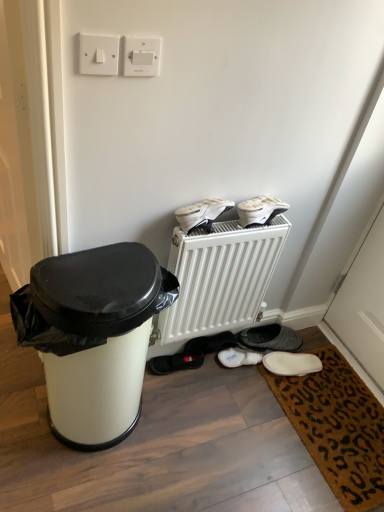
Image resolution: width=384 pixels, height=512 pixels. Identify the location of brown coir mat at lower right. (337, 426).

Measure the distance between point (x=223, y=364) and camera.

They are 5.64 feet apart.

This screenshot has width=384, height=512. What do you see at coordinates (201, 214) in the screenshot? I see `white matte sneakers at upper center, the first footwear from the front` at bounding box center [201, 214].

You are a GUI agent. You are given a task and a screenshot of the screen. Output one action in this format:
    pyautogui.click(x=<x>, y=<y>)
    Task: Click on the brown coir mat at lower right
    This screenshot has width=384, height=512.
    Given the screenshot: What is the action you would take?
    pos(337,426)

In terms of height, does white matte plastic trash can at left look taller or shorter compared to white plastic switch at upper center, marked as the first electric outlet in a right-to-left arrangement?

Considering their sizes, white matte plastic trash can at left has more height than white plastic switch at upper center, marked as the first electric outlet in a right-to-left arrangement.

From a real-world perspective, is white matte plastic trash can at left physically above white plastic switch at upper center, marked as the first electric outlet in a right-to-left arrangement?

Actually, white matte plastic trash can at left is physically below white plastic switch at upper center, marked as the first electric outlet in a right-to-left arrangement, in the real world.

Based on the photo, from the image's perspective, is white matte plastic trash can at left located beneath white plastic switch at upper center, marked as the first electric outlet in a right-to-left arrangement?

Correct, white matte plastic trash can at left appears lower than white plastic switch at upper center, marked as the first electric outlet in a right-to-left arrangement, in the image.

Is white matte plastic trash can at left oriented away from white plastic switch at upper center, marked as the first electric outlet in a right-to-left arrangement?

No, white matte plastic trash can at left is not facing away from white plastic switch at upper center, marked as the first electric outlet in a right-to-left arrangement.

Between white plastic switch at upper center, marked as the first electric outlet in a right-to-left arrangement, and white matte plastic trash can at left, which one has smaller width?

Thinner between the two is white plastic switch at upper center, marked as the first electric outlet in a right-to-left arrangement.

How distant is white plastic switch at upper center, marked as the first electric outlet in a right-to-left arrangement, from white matte plastic trash can at left?

28.33 inches.

Is white plastic switch at upper center, marked as the first electric outlet in a right-to-left arrangement, positioned beyond the bounds of white matte plastic trash can at left?

Yes, white plastic switch at upper center, marked as the first electric outlet in a right-to-left arrangement, is outside of white matte plastic trash can at left.

From the image's perspective, is white plastic switch at upper center, marked as the first electric outlet in a right-to-left arrangement, positioned above or below white matte plastic trash can at left?

white plastic switch at upper center, marked as the first electric outlet in a right-to-left arrangement, is above white matte plastic trash can at left.

From the image's perspective, is white matte plastic trash can at left over white matte sneakers at upper center, which is counted as the second footwear, starting from the front?

No.

Is white matte plastic trash can at left aimed at white matte sneakers at upper center, arranged as the 2th footwear when viewed from the back?

No, white matte plastic trash can at left does not turn towards white matte sneakers at upper center, arranged as the 2th footwear when viewed from the back.

Is white matte plastic trash can at left to the left or to the right of white matte sneakers at upper center, arranged as the 2th footwear when viewed from the back, in the image?

white matte plastic trash can at left is positioned on white matte sneakers at upper center, arranged as the 2th footwear when viewed from the back,'s left side.

Can you see white matte plastic trash can at left touching white matte sneakers at upper center, arranged as the 2th footwear when viewed from the back?

No, white matte plastic trash can at left is not next to white matte sneakers at upper center, arranged as the 2th footwear when viewed from the back.

Which object is wider, white suede slippers at lower center, acting as the third footwear starting from the front, or white plastic switch at upper left, which appears as the second electric outlet when viewed from the right?

Wider between the two is white suede slippers at lower center, acting as the third footwear starting from the front.

From the image's perspective, which footwear is the 3rd one below the white plastic switch at upper left, which appears as the second electric outlet when viewed from the right? Please provide its 2D coordinates.

[(239, 357)]

Considering the points (223, 357) and (81, 50), which point is behind, point (223, 357) or point (81, 50)?

The point (223, 357) is farther.

Considering the sizes of objects white suede slippers at lower center, acting as the third footwear starting from the front, and white plastic switch at upper left, the 1th electric outlet from the left, in the image provided, who is bigger, white suede slippers at lower center, acting as the third footwear starting from the front, or white plastic switch at upper left, the 1th electric outlet from the left,?

white suede slippers at lower center, acting as the third footwear starting from the front.

This screenshot has width=384, height=512. Find the location of `radiator below the white matte sneakers at upper center, arranged as the 2th footwear when viewed from the back (from a real-world perspective)`. radiator below the white matte sneakers at upper center, arranged as the 2th footwear when viewed from the back (from a real-world perspective) is located at coordinates (220, 277).

Considering the sizes of objects white plastic radiator at center and white matte sneakers at upper center, the first footwear from the top, in the image provided, who is wider, white plastic radiator at center or white matte sneakers at upper center, the first footwear from the top,?

With larger width is white plastic radiator at center.

Is white plastic radiator at center outside of white matte sneakers at upper center, which is counted as the second footwear, starting from the front?

Yes.

From a real-world perspective, between white plastic radiator at center and white matte sneakers at upper center, which ranks as the third footwear in bottom-to-top order, who is vertically lower?

white plastic radiator at center is physically lower.

In the scene shown: Does white plastic radiator at center touch white plastic switch at upper left, which appears as the second electric outlet when viewed from the right?

white plastic radiator at center and white plastic switch at upper left, which appears as the second electric outlet when viewed from the right, are not in contact.

Is white plastic radiator at center facing away from white plastic switch at upper left, which appears as the second electric outlet when viewed from the right?

No.

In terms of size, does white plastic radiator at center appear bigger or smaller than white plastic switch at upper left, which appears as the second electric outlet when viewed from the right?

In the image, white plastic radiator at center appears to be larger than white plastic switch at upper left, which appears as the second electric outlet when viewed from the right.

You are a GUI agent. You are given a task and a screenshot of the screen. Output one action in this format:
    pyautogui.click(x=<x>, y=<y>)
    Task: Click on the radiator lying behind the white plastic switch at upper left, which appears as the second electric outlet when viewed from the right
    The width and height of the screenshot is (384, 512).
    Given the screenshot: What is the action you would take?
    pyautogui.click(x=220, y=277)

Who is bigger, white suede slippers at lower center, acting as the third footwear starting from the front, or white matte sneakers at upper center, which is counted as the second footwear, starting from the front?

Bigger between the two is white matte sneakers at upper center, which is counted as the second footwear, starting from the front.

Is white suede slippers at lower center, the first footwear when ordered from bottom to top, at the right side of white matte sneakers at upper center, which is counted as the second footwear, starting from the front?

No.

Starting from the white matte sneakers at upper center, the first footwear from the top, which footwear is the 1st one to the left? Please provide its 2D coordinates.

[(239, 357)]

From a real-world perspective, which is physically above, white suede slippers at lower center, which appears as the third footwear when viewed from the top, or white matte sneakers at upper center, which is counted as the second footwear, starting from the front?

white matte sneakers at upper center, which is counted as the second footwear, starting from the front.

From the image's perspective, count 2nd electric outlets upward from the white matte plastic trash can at left and point to it. Please provide its 2D coordinates.

[(141, 56)]

Locate an element on the screen. The image size is (384, 512). electric outlet behind the white matte plastic trash can at left is located at coordinates (141, 56).

When comparing their distances from white plastic switch at upper left, the 1th electric outlet from the left, does white matte sneakers at upper center, the 2th footwear when ordered from bottom to top, or white plastic radiator at center seem further?

Among the two, white plastic radiator at center is located further to white plastic switch at upper left, the 1th electric outlet from the left.

Estimate the real-world distances between objects in this image. Which object is further from white matte sneakers at upper center, arranged as the second footwear when viewed from the top, white suede slippers at lower center, arranged as the first footwear when viewed from the back, or white plastic radiator at center?

white suede slippers at lower center, arranged as the first footwear when viewed from the back, is positioned further to the anchor white matte sneakers at upper center, arranged as the second footwear when viewed from the top.

Which object lies nearer to the anchor point white plastic switch at upper center, marked as the first electric outlet in a right-to-left arrangement, white matte sneakers at upper center, which is counted as the second footwear, starting from the front, or white matte plastic trash can at left?

Based on the image, white matte sneakers at upper center, which is counted as the second footwear, starting from the front, appears to be nearer to white plastic switch at upper center, marked as the first electric outlet in a right-to-left arrangement.

Based on their spatial positions, is white plastic switch at upper center, marked as the first electric outlet in a right-to-left arrangement, or white suede slippers at lower center, arranged as the first footwear when viewed from the back, closer to white matte sneakers at upper center, arranged as the second footwear when viewed from the top?

white plastic switch at upper center, marked as the first electric outlet in a right-to-left arrangement, is closer to white matte sneakers at upper center, arranged as the second footwear when viewed from the top.

Considering their positions, is white plastic radiator at center positioned closer to white matte sneakers at upper center, which ranks as the third footwear in bottom-to-top order, than brown coir mat at lower right?

The object closer to white matte sneakers at upper center, which ranks as the third footwear in bottom-to-top order, is white plastic radiator at center.

Estimate the real-world distances between objects in this image. Which object is further from brown coir mat at lower right, white matte sneakers at upper center, the 2th footwear when ordered from bottom to top, or white matte sneakers at upper center, arranged as the 2th footwear when viewed from the back?

The object further to brown coir mat at lower right is white matte sneakers at upper center, the 2th footwear when ordered from bottom to top.

When comparing their distances from white matte sneakers at upper center, the first footwear from the top, does white plastic radiator at center or white plastic switch at upper center, which appears as the second electric outlet when viewed from the left, seem further?

Based on the image, white plastic switch at upper center, which appears as the second electric outlet when viewed from the left, appears to be further to white matte sneakers at upper center, the first footwear from the top.

Based on their spatial positions, is white suede slippers at lower center, acting as the third footwear starting from the front, or white plastic switch at upper left, the 1th electric outlet from the left, closer to white matte plastic trash can at left?

white suede slippers at lower center, acting as the third footwear starting from the front, lies closer to white matte plastic trash can at left than the other object.

The width and height of the screenshot is (384, 512). In order to click on radiator between white plastic switch at upper left, which appears as the second electric outlet when viewed from the right, and brown coir mat at lower right in the up-down direction in this screenshot , I will do `click(220, 277)`.

The image size is (384, 512). Identify the location of radiator that lies between white plastic switch at upper center, which appears as the second electric outlet when viewed from the left, and white matte plastic trash can at left from top to bottom. (220, 277).

Where is `radiator between white matte plastic trash can at left and white suede slippers at lower center, arranged as the first footwear when viewed from the back, in the front-back direction`? radiator between white matte plastic trash can at left and white suede slippers at lower center, arranged as the first footwear when viewed from the back, in the front-back direction is located at coordinates (220, 277).

Identify the location of footwear between white plastic switch at upper center, which appears as the second electric outlet when viewed from the left, and white matte sneakers at upper center, which is counted as the second footwear, starting from the front, in the front-back direction. This screenshot has height=512, width=384. (201, 214).